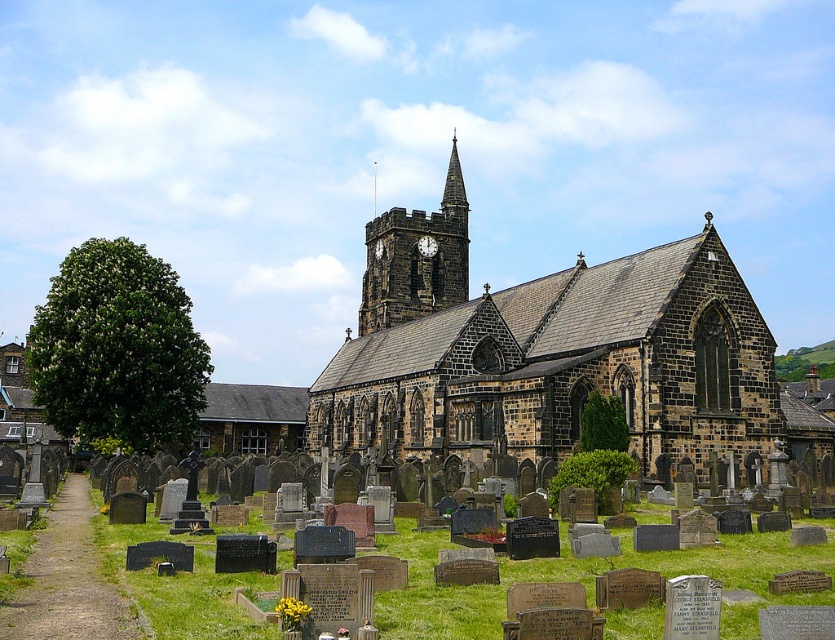
Question: Which of the following is the farthest from the observer?

Choices:
 (A) stone clock tower at center
 (B) white wooden clock at center
 (C) brown stone church at center
 (D) smooth stone spire at upper center

Answer: (D)

Question: Is stone clock tower at center smaller than smooth stone spire at upper center?

Choices:
 (A) yes
 (B) no

Answer: (B)

Question: Where is smooth stone spire at upper center located in relation to white wooden clock at center in the image?

Choices:
 (A) left
 (B) right

Answer: (B)

Question: Which object is the closest to the stone clock tower at center?

Choices:
 (A) brown stone church at center
 (B) smooth stone spire at upper center
 (C) white wooden clock at center

Answer: (C)

Question: Is smooth stone spire at upper center to the left of white wooden clock at center from the viewer's perspective?

Choices:
 (A) yes
 (B) no

Answer: (B)

Question: Among these objects, which one is nearest to the camera?

Choices:
 (A) white wooden clock at center
 (B) smooth stone spire at upper center
 (C) brown stone church at center
 (D) stone clock tower at center

Answer: (C)